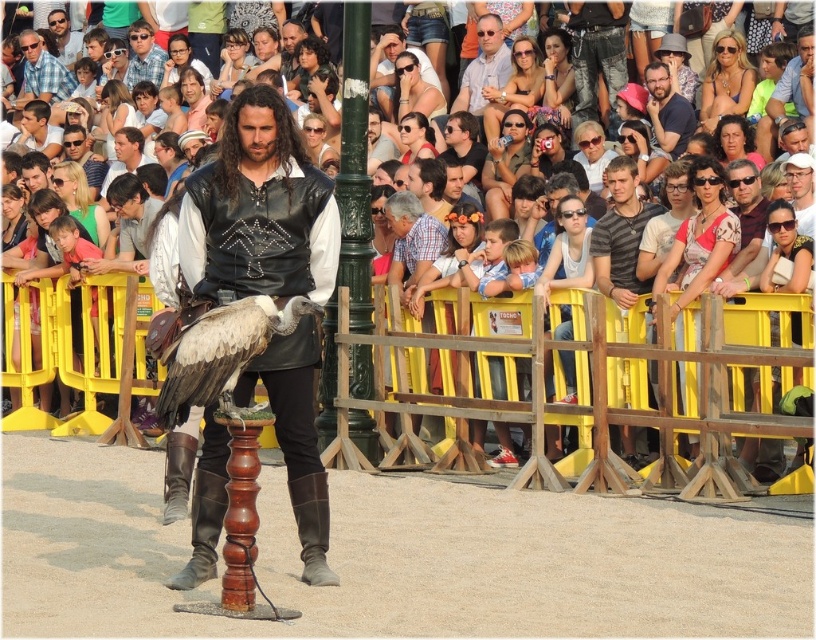
Is striped cotton shirt at center thinner than light blue plaid shirt at upper left?

Yes.

Can you confirm if striped cotton shirt at center is shorter than light blue plaid shirt at upper left?

Correct, striped cotton shirt at center is not as tall as light blue plaid shirt at upper left.

Does point (636, 218) come closer to viewer compared to point (47, 58)?

Yes, it is.

At what (x,y) coordinates should I click in order to perform the action: click on striped cotton shirt at center. Please return your answer as a coordinate pair (x, y). Looking at the image, I should click on (619, 236).

Is striped cotton shirt at center further to the viewer compared to matte blue shirt at upper right?

No, striped cotton shirt at center is closer to the viewer.

Which is below, striped cotton shirt at center or matte blue shirt at upper right?

striped cotton shirt at center is below.

Is point (639, 289) positioned in front of point (664, 74)?

Yes, it is in front of point (664, 74).

Where is `striped cotton shirt at center`? The image size is (816, 640). striped cotton shirt at center is located at coordinates (619, 236).

What do you see at coordinates (619, 236) in the screenshot?
I see `striped cotton shirt at center` at bounding box center [619, 236].

Can you confirm if striped cotton shirt at center is bigger than matte black sunglasses at upper center?

No, striped cotton shirt at center is not bigger than matte black sunglasses at upper center.

You are a GUI agent. You are given a task and a screenshot of the screen. Output one action in this format:
    pyautogui.click(x=<x>, y=<y>)
    Task: Click on the striped cotton shirt at center
    
    Given the screenshot: What is the action you would take?
    pyautogui.click(x=619, y=236)

Where is `striped cotton shirt at center`? striped cotton shirt at center is located at coordinates (619, 236).